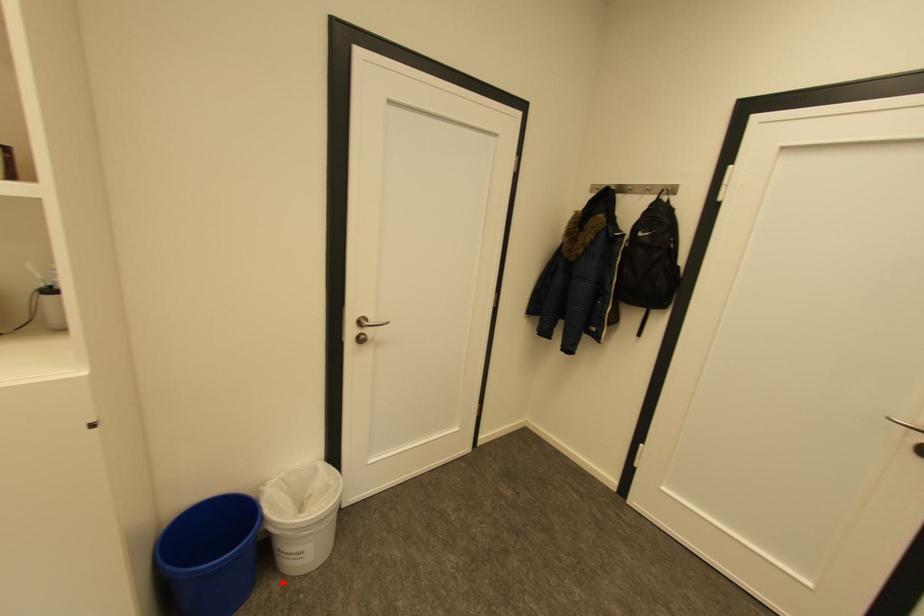
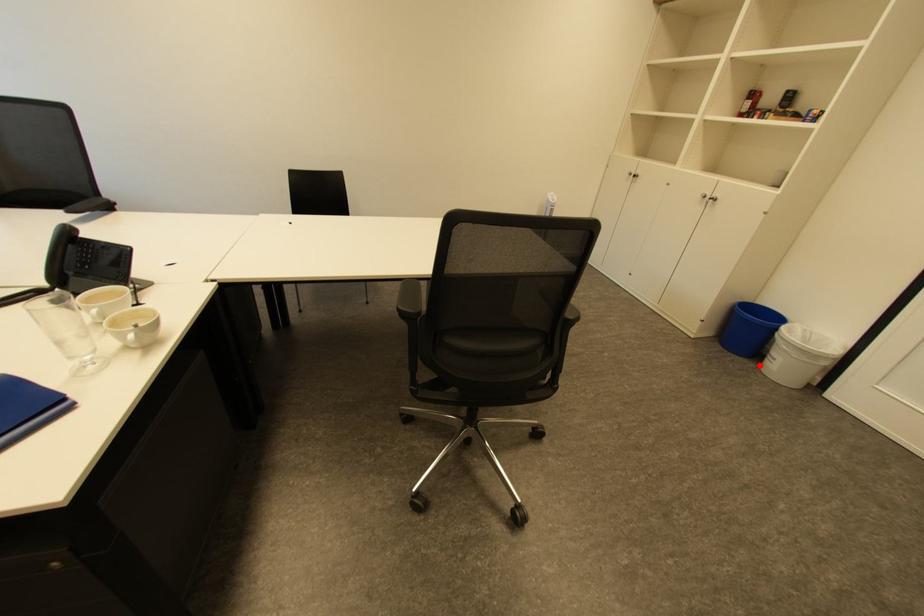
I am providing you with two images of the same scene from different viewpoints. A red point is marked on the first image and another point is marked on the second image. Is the marked point in image1 the same physical position as the marked point in image2?

Yes